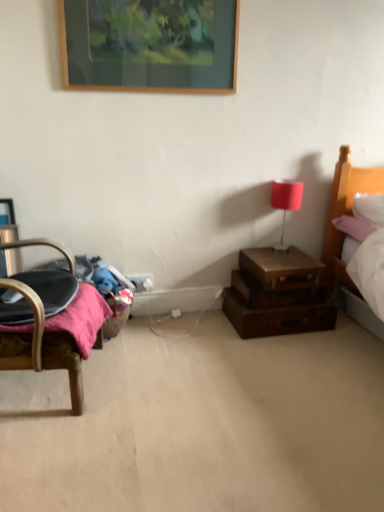
Question: Is brown wooden drawers at lower right looking in the opposite direction of wooden picture frame at upper center?

Choices:
 (A) yes
 (B) no

Answer: (B)

Question: Is brown wooden drawers at lower right bigger than wooden picture frame at upper center?

Choices:
 (A) yes
 (B) no

Answer: (A)

Question: Considering the relative sizes of brown wooden drawers at lower right and wooden picture frame at upper center in the image provided, is brown wooden drawers at lower right wider than wooden picture frame at upper center?

Choices:
 (A) yes
 (B) no

Answer: (A)

Question: Is brown wooden drawers at lower right taller than wooden picture frame at upper center?

Choices:
 (A) no
 (B) yes

Answer: (A)

Question: Is brown wooden drawers at lower right further to the viewer compared to wooden picture frame at upper center?

Choices:
 (A) no
 (B) yes

Answer: (B)

Question: Can you confirm if brown wooden drawers at lower right is thinner than wooden picture frame at upper center?

Choices:
 (A) no
 (B) yes

Answer: (A)

Question: Is brown leather suitcase at right in contact with wooden picture frame at upper center?

Choices:
 (A) no
 (B) yes

Answer: (A)

Question: Would you consider brown leather suitcase at right to be distant from wooden picture frame at upper center?

Choices:
 (A) yes
 (B) no

Answer: (A)

Question: Considering the relative positions of brown leather suitcase at right and wooden picture frame at upper center in the image provided, is brown leather suitcase at right to the left of wooden picture frame at upper center from the viewer's perspective?

Choices:
 (A) yes
 (B) no

Answer: (B)

Question: Can you confirm if brown leather suitcase at right is bigger than wooden picture frame at upper center?

Choices:
 (A) no
 (B) yes

Answer: (B)

Question: Can you confirm if brown leather suitcase at right is smaller than wooden picture frame at upper center?

Choices:
 (A) no
 (B) yes

Answer: (A)

Question: Can you confirm if brown leather suitcase at right is shorter than wooden picture frame at upper center?

Choices:
 (A) yes
 (B) no

Answer: (A)

Question: Does matte red table lamp at upper right have a greater width compared to brown leather suitcase at lower right?

Choices:
 (A) yes
 (B) no

Answer: (B)